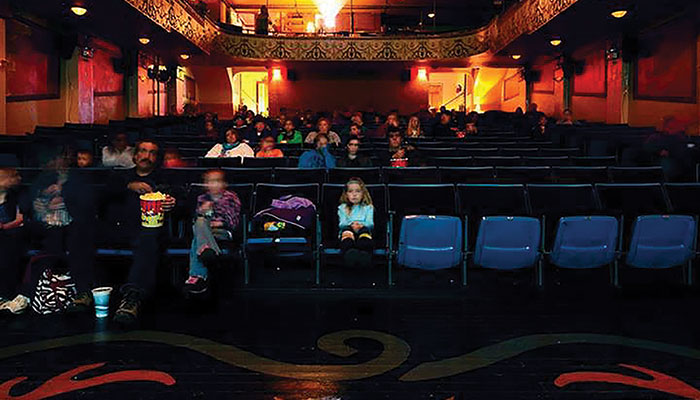
Find the location of `doorway`. doorway is located at coordinates (250, 95), (444, 98).